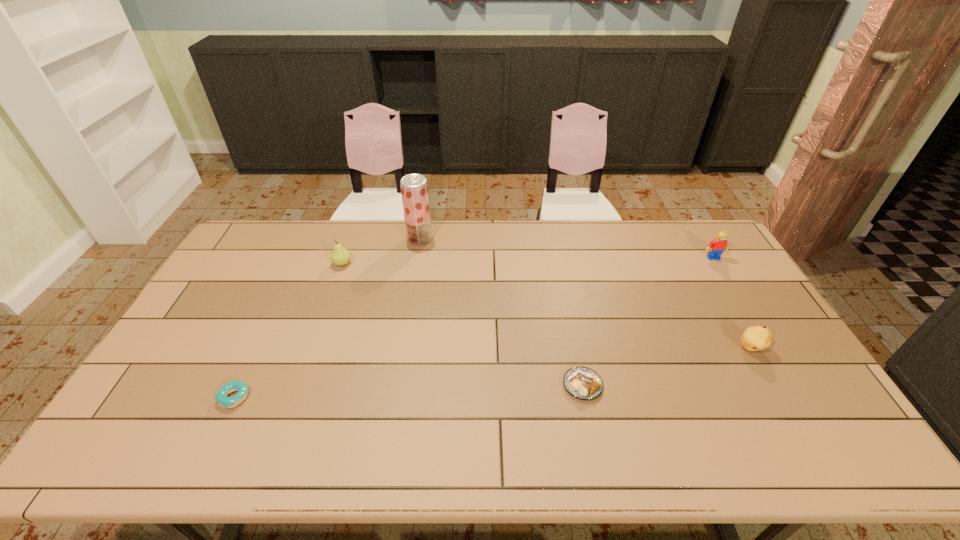
Locate an element on the screen. the shortest object is located at coordinates (221, 397).

Find the location of `vacant space situated 0.390m on the left of the tallest object`. vacant space situated 0.390m on the left of the tallest object is located at coordinates (303, 239).

I want to click on free spot located on the face of the Lego, so click(x=738, y=298).

Identify the location of vacant space situated on the left of the left pear. The height and width of the screenshot is (540, 960). (306, 264).

Where is `free space located on the back of the third nearest object`? free space located on the back of the third nearest object is located at coordinates (735, 322).

Locate an element on the screen. The width and height of the screenshot is (960, 540). vacant space situated 0.390m on the right of the pastry is located at coordinates (749, 386).

At what (x,y) coordinates should I click in order to perform the action: click on vacant space located on the right of the shortest object. Please return your answer as a coordinate pair (x, y). The width and height of the screenshot is (960, 540). Looking at the image, I should click on (323, 397).

The width and height of the screenshot is (960, 540). I want to click on fruit juice that is at the far edge, so click(x=414, y=188).

Locate an element on the screen. This screenshot has width=960, height=540. Lego located at the far edge is located at coordinates (716, 247).

Locate an element on the screen. pear present at the far edge is located at coordinates (340, 256).